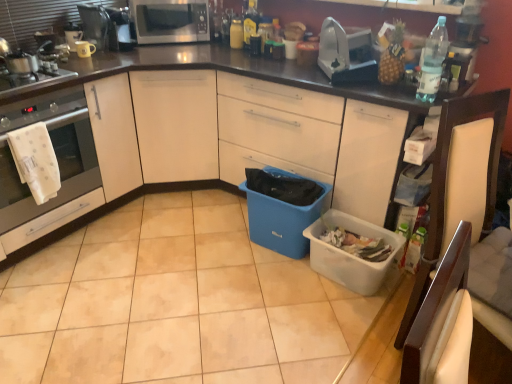
This screenshot has width=512, height=384. What are the coordinates of `free space to the left of white plastic storage box at lower right, which is counted as the first storage box, starting from the right` in the screenshot? It's located at (279, 288).